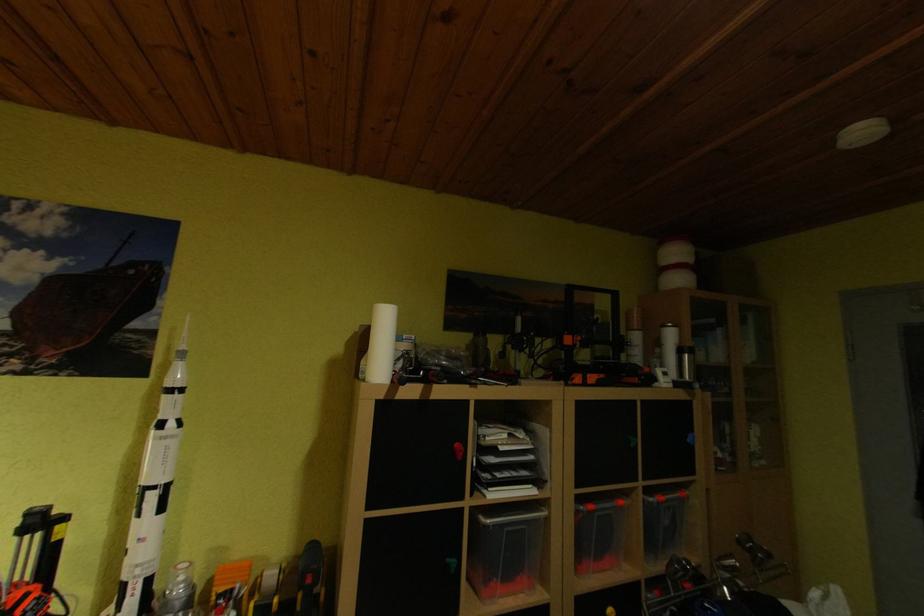
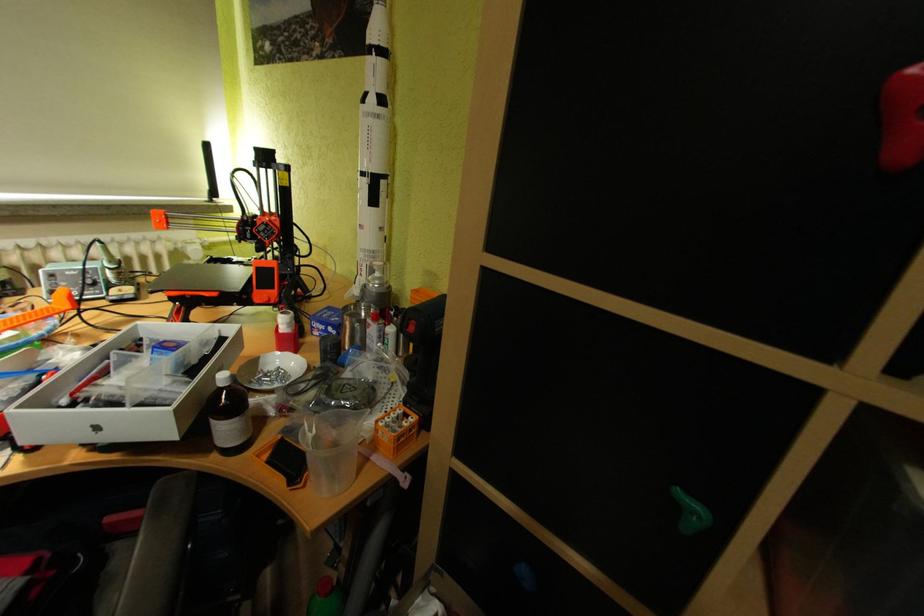
Based on the continuous images, in which direction is the camera rotating?

The camera rotated toward left-down.